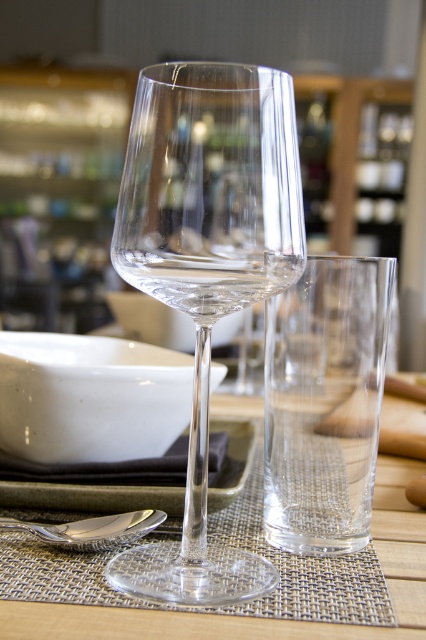
You are setting up a table for a dinner party and need to place a 15 cm tall candle holder between the transparent glass wine glass at center and the silver metallic spoon at lower left. Can the candle holder fit vertically between them without touching either object?

The transparent glass wine glass at center is taller than the silver metallic spoon at lower left. Since the candle holder is 15 cm tall, it can fit vertically between them as long as there is enough horizontal space between the two objects to accommodate its base without touching either.

You are arranging items on a dining table and need to place a decorative vase. The black fabric tray at center is already there. Where should you place the vase so it doesn not block the tray?

Place the vase away from the coordinates of the black fabric tray at center, which is at point (92, 496), to ensure it doesn not block the tray.

You are setting up a table and need to place a centerpiece. The black fabric tray at center currently holds some items. If you want to move the transparent glass wine glass at center to the left side of the tray, will it fit without overlapping?

The transparent glass wine glass at center is currently to the right of the black fabric tray at center. Since the tray is at the center, moving the wine glass to the left side of the tray would require space on that side. However, the description does not provide information about the available space or size of the tray, so it is uncertain if it will fit without overlapping.